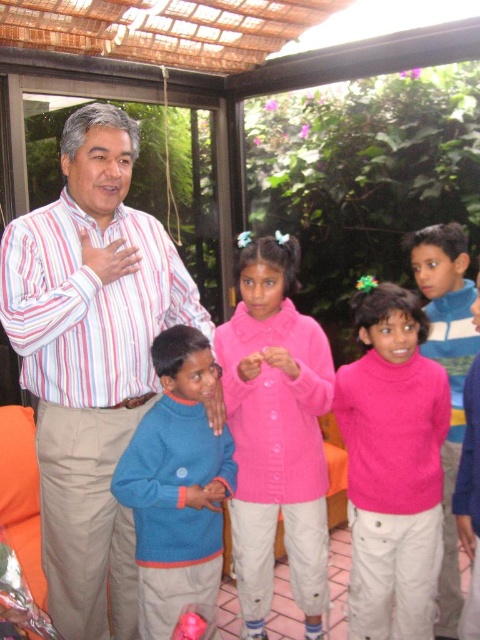
You are a photographer trying to capture a closeup of the pink woolen sweater at center and the blue sweater at center. Which one should you focus on first if you want to ensure both are in focus without moving the camera?

The pink woolen sweater at center is above the blue sweater at center, so focusing on the pink woolen sweater at center first will ensure both are in focus since it is closer to the camera.

You are a tailor measuring the distance between two pink sweaters in the image. The first is a pink matte sweater at center and the second is a pink woolen sweater at center. The tailor needs to know if the distance between them is more than 10 inches to decide whether to place a rack between them. Can you tell the tailor if the distance is more than 10 inches?

The distance between the pink matte sweater at center and the pink woolen sweater at center is 9.91 inches, which is less than 10 inches. Therefore, the tailor does not need to place a rack between them.